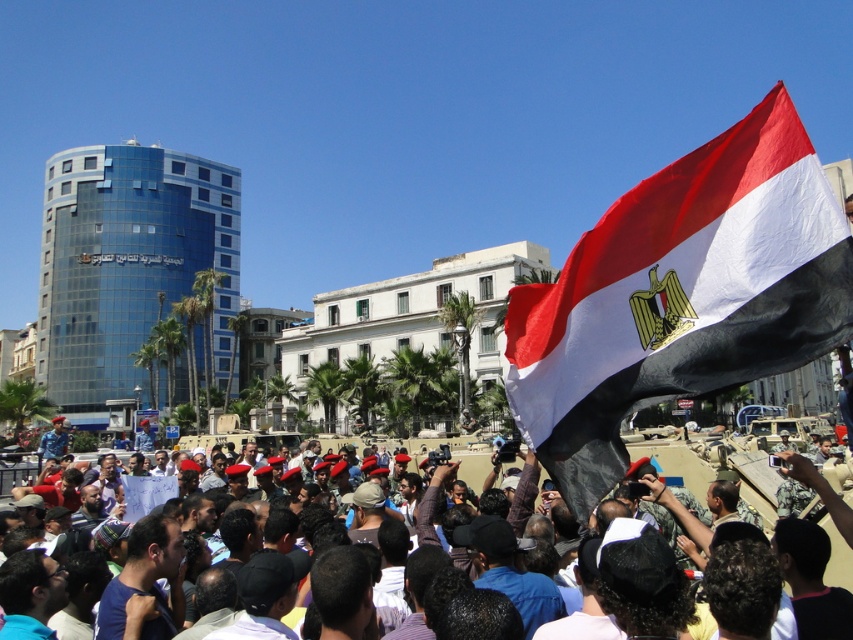
Based on the photo, does red-white-black fabric flag at upper right have a larger size compared to matte black crowd at center?

Correct, red-white-black fabric flag at upper right is larger in size than matte black crowd at center.

Who is shorter, red-white-black fabric flag at upper right or matte black crowd at center?

matte black crowd at center is shorter.

Find the location of `red-white-black fabric flag at upper right`. red-white-black fabric flag at upper right is located at coordinates (680, 296).